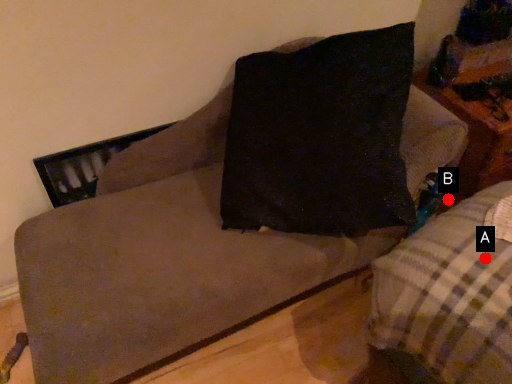
Question: Two points are circled on the image, labeled by A and B beside each circle. Which point is further to the camera?

Choices:
 (A) A is further
 (B) B is further

Answer: (B)